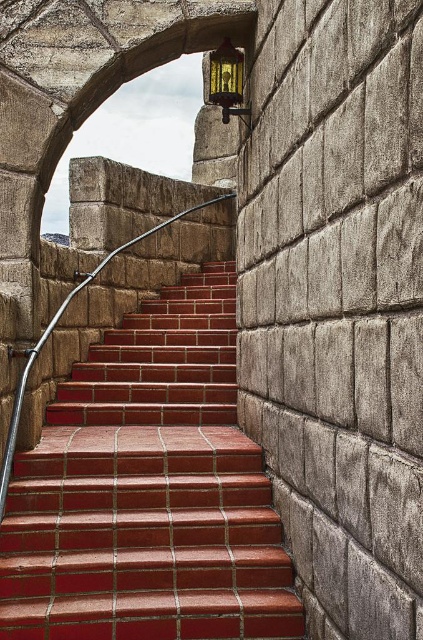
You are a painter who needs to reach both the polished metal handrail at center and the gold textured lantern at upper center to touch them up. Which object will require you to use a ladder to reach it?

The gold textured lantern at upper center will require a ladder since it is taller than the polished metal handrail at center.

You are carrying a large painting that is 2 meters wide and need to walk up the red brick stairs at center while avoiding the gold textured lantern at upper center. Can you fit through the space between the handrail and the lantern without tilting the painting?

The red brick stairs at center are wider than the gold textured lantern at upper center, so there should be enough space for the painting to pass through without tilting, as the stairs provide a broader pathway compared to the lantern.